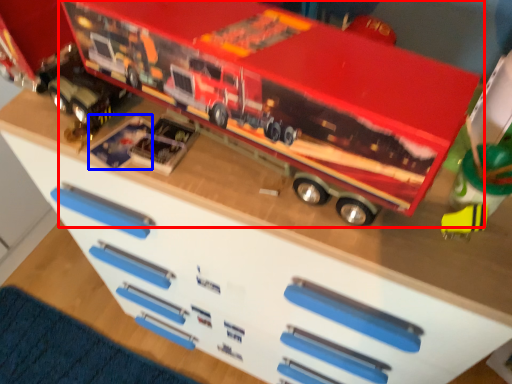
Question: Which of the following is the closest to the observer, toy (highlighted by a red box) or toy (highlighted by a blue box)?

Choices:
 (A) toy
 (B) toy

Answer: (A)